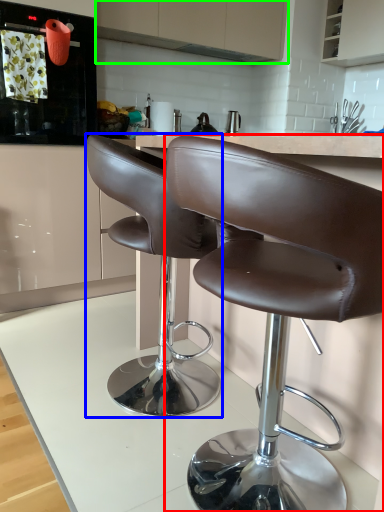
Question: Estimate the real-world distances between objects in this image. Which object is closer to chair (highlighted by a red box), chair (highlighted by a blue box) or cabinetry (highlighted by a green box)?

Choices:
 (A) chair
 (B) cabinetry

Answer: (A)